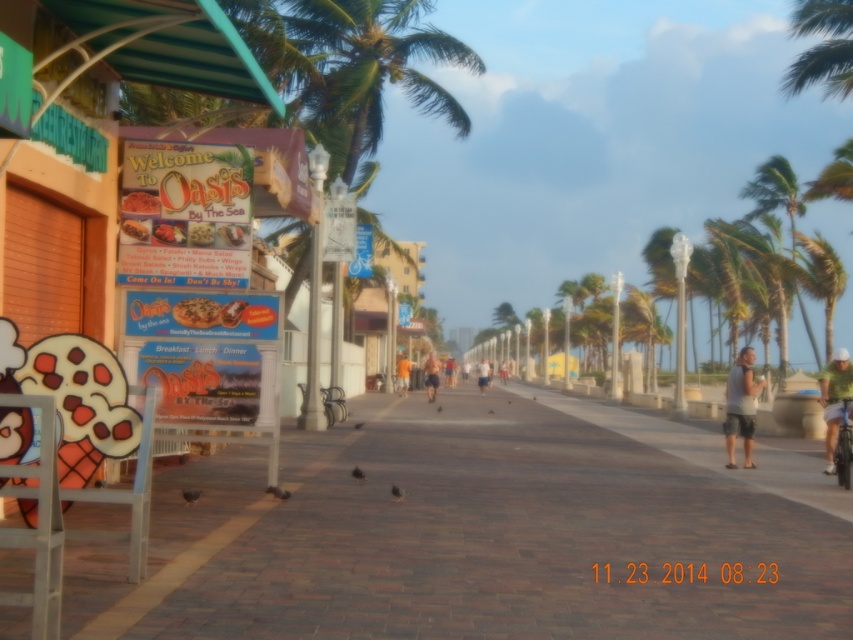
Question: Can you confirm if green leafy palm tree at right is wider than light brown shorts at center?

Choices:
 (A) yes
 (B) no

Answer: (A)

Question: Based on their relative distances, which object is nearer to the green leafy palm tree at upper right?

Choices:
 (A) brown brick pavement at center
 (B) light brown skin at center
 (C) orange fabric shorts at center
 (D) green leafy palm tree at right

Answer: (D)

Question: Which point appears closest to the camera in this image?

Choices:
 (A) (759, 180)
 (B) (399, 368)
 (C) (833, 364)

Answer: (C)

Question: Among these objects, which one is farthest from the camera?

Choices:
 (A) dark blue shorts at center
 (B) light brown skin at center
 (C) orange fabric shorts at center

Answer: (B)

Question: Observing the image, what is the correct spatial positioning of green fabric shirt at right in reference to dark blue shorts at center?

Choices:
 (A) left
 (B) right

Answer: (B)

Question: Is brown brick pavement at center below dark blue shorts at center?

Choices:
 (A) no
 (B) yes

Answer: (B)